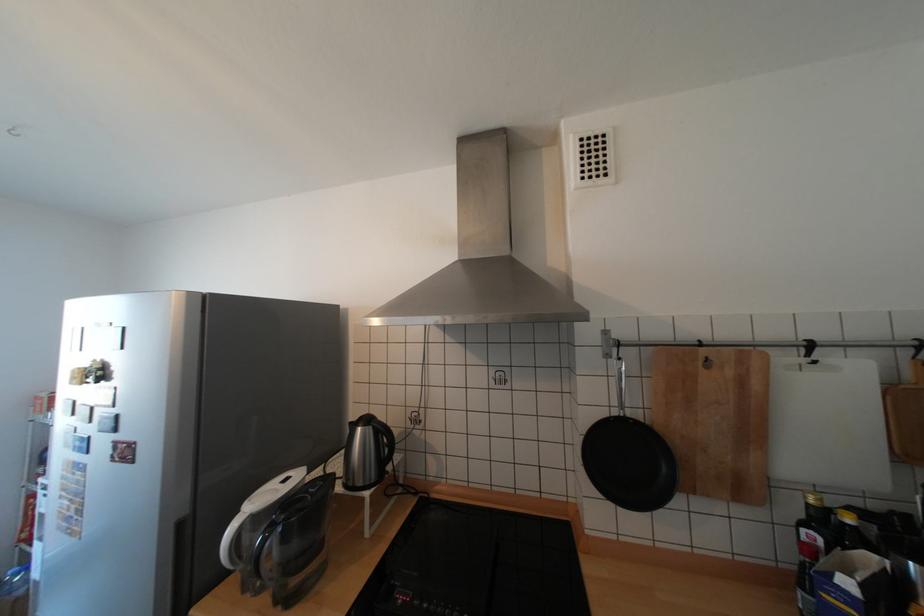
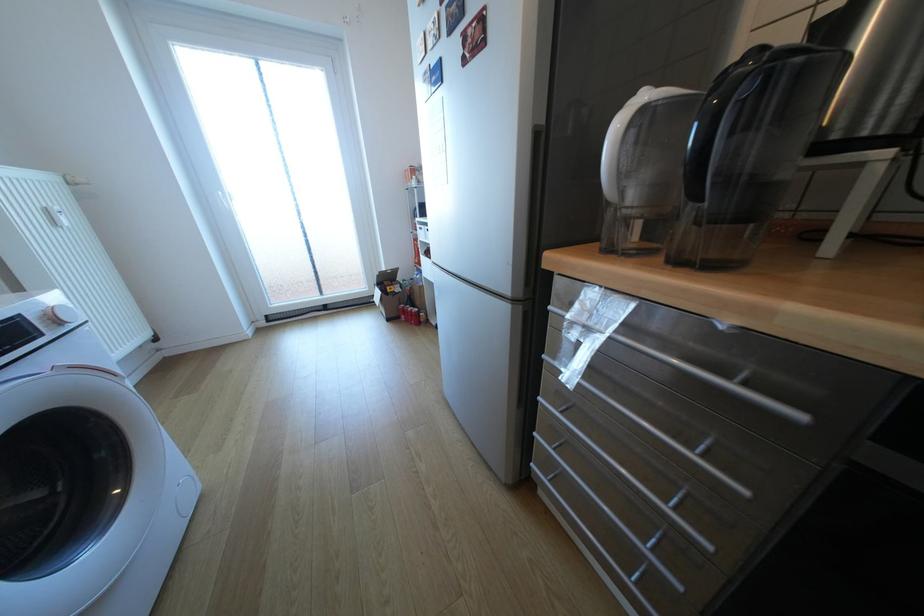
First-person continuous shooting, in which direction is the camera rotating?

The rotation direction of the camera is left-down.